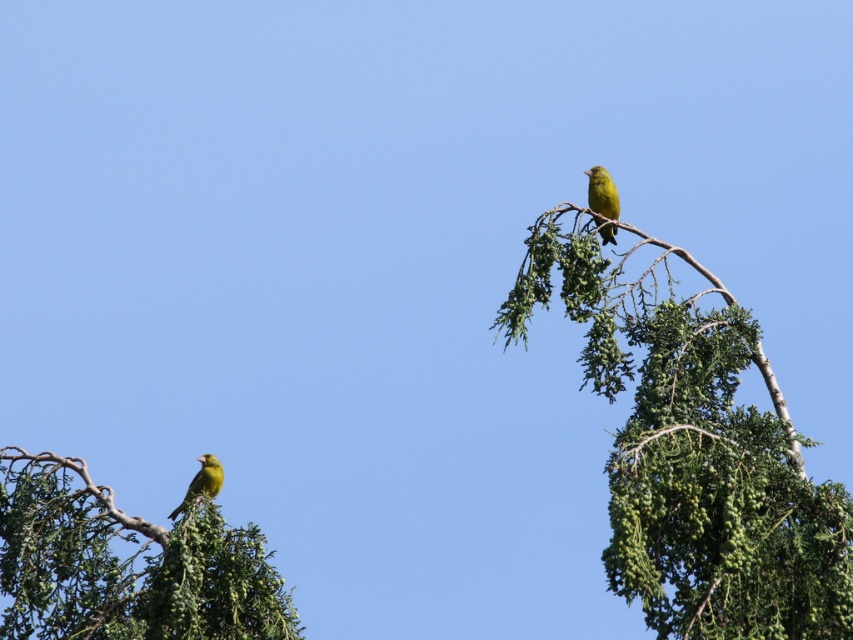
Is bright yellow bird at upper right to the right of shiny green bird at upper left from the viewer's perspective?

Correct, you'll find bright yellow bird at upper right to the right of shiny green bird at upper left.

Who is more distant from viewer, (604, 192) or (192, 488)?

The point (192, 488) is more distant.

Locate an element on the screen. bright yellow bird at upper right is located at coordinates (602, 193).

Measure the distance between green leafy branch at upper right and camera.

42.55 feet

Who is positioned more to the left, green leafy branch at upper right or shiny green bird at upper left?

Positioned to the left is shiny green bird at upper left.

Who is more forward, (590, 348) or (184, 508)?

Point (590, 348)

The image size is (853, 640). Identify the location of green leafy branch at upper right. (694, 456).

Who is positioned more to the right, green leafy branch at upper right or green leafy branch at lower left?

Positioned to the right is green leafy branch at upper right.

Can you confirm if green leafy branch at upper right is positioned to the left of green leafy branch at lower left?

In fact, green leafy branch at upper right is to the right of green leafy branch at lower left.

The image size is (853, 640). I want to click on green leafy branch at upper right, so click(x=694, y=456).